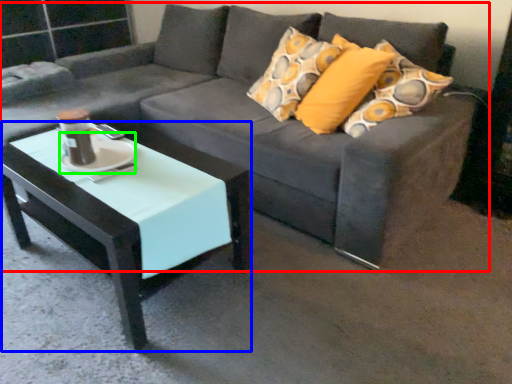
Question: Which object is the farthest from studio couch (highlighted by a red box)? Choose among these: coffee table (highlighted by a blue box) or saucer (highlighted by a green box).

Choices:
 (A) coffee table
 (B) saucer

Answer: (B)